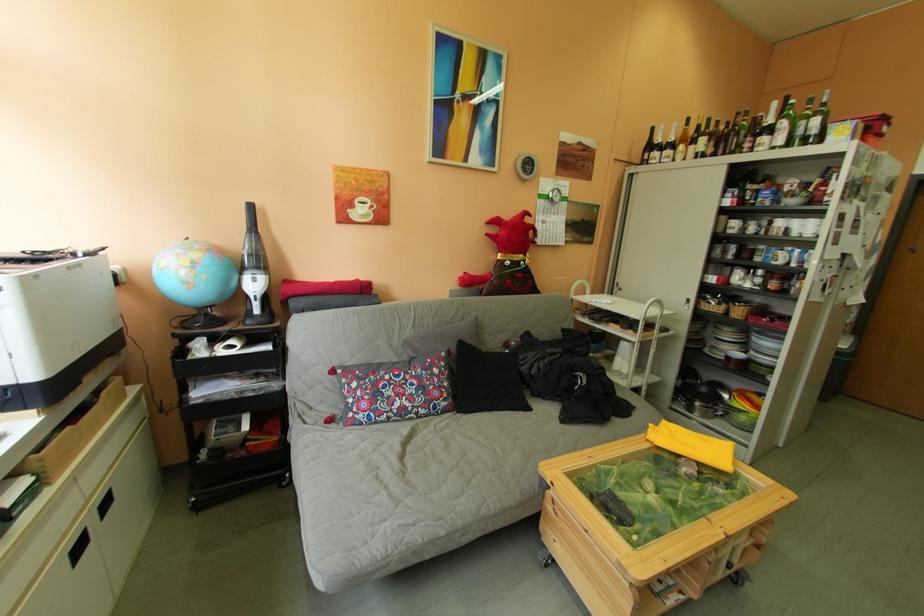
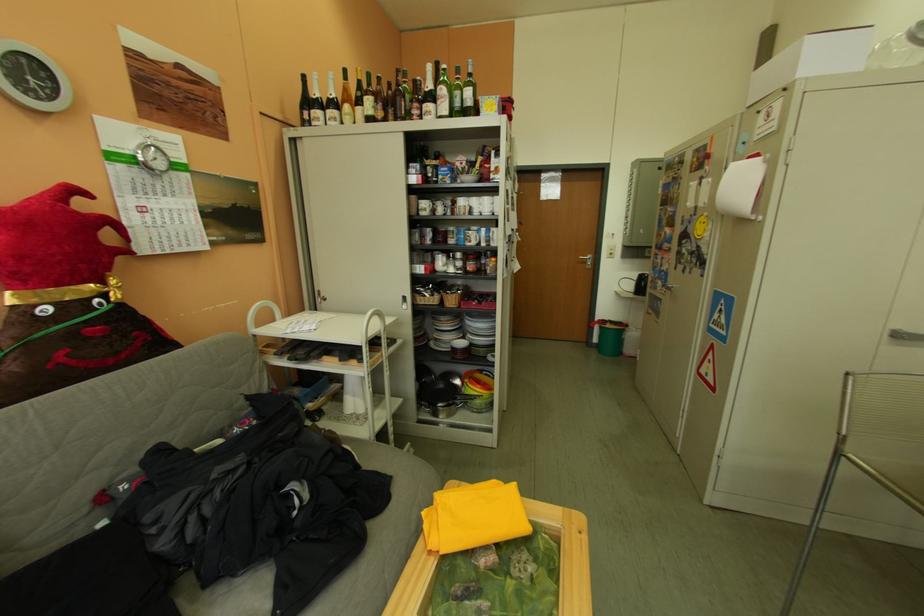
In the second image, find the point that corresponds to point 723,306 in the first image.

(438, 299)